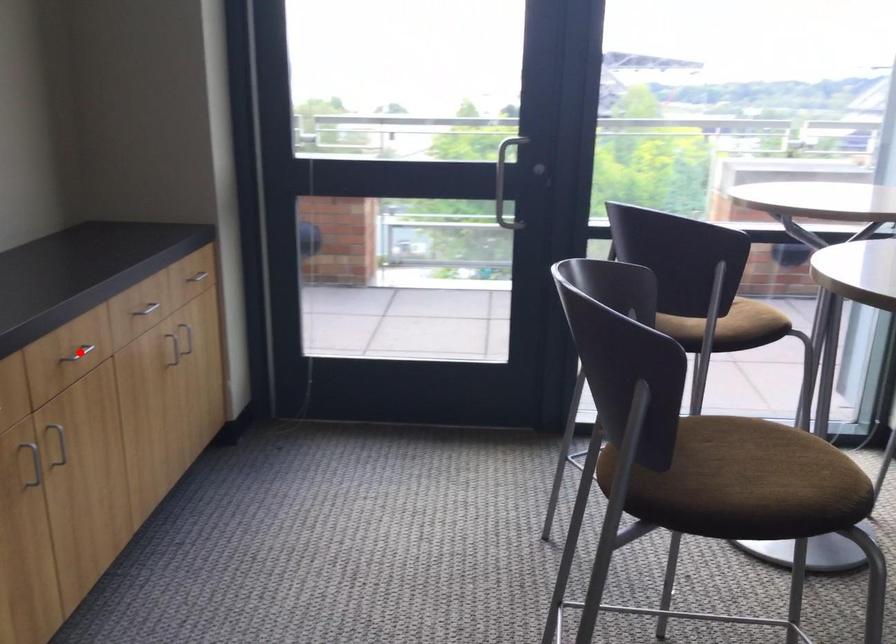
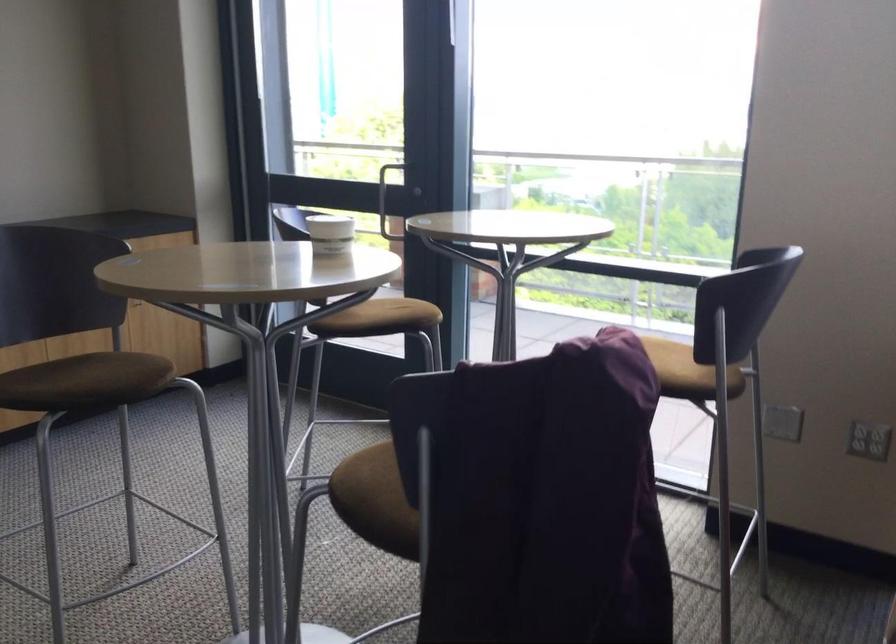
Question: I am providing you with two images of the same scene from different viewpoints. A red point is marked on the first image. Can you still see the location of the red point in image 2?

Choices:
 (A) Yes
 (B) No

Answer: (B)